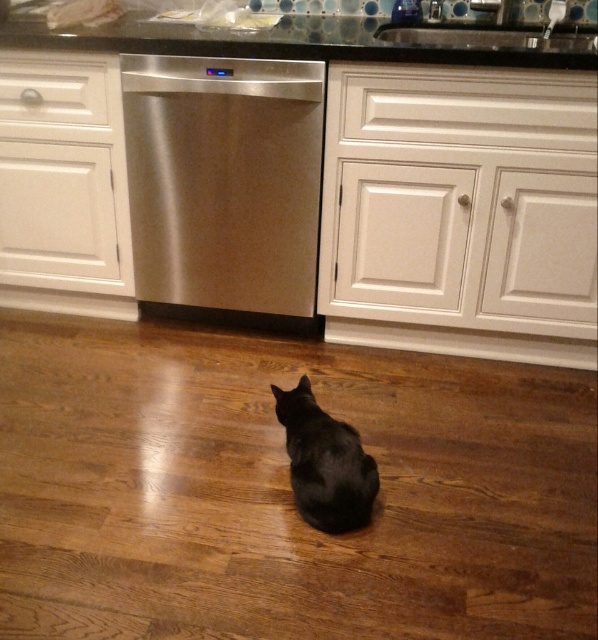
Question: Estimate the real-world distances between objects in this image. Which object is closer to the black fur cat at center?

Choices:
 (A) glassy granite countertop at upper center
 (B) stainless steel dishwasher at center

Answer: (B)

Question: Which object appears closest to the camera in this image?

Choices:
 (A) glassy granite countertop at upper center
 (B) stainless steel dishwasher at center
 (C) black fur cat at center

Answer: (C)

Question: Is the position of stainless steel dishwasher at center less distant than that of black fur cat at center?

Choices:
 (A) no
 (B) yes

Answer: (A)

Question: Is the position of stainless steel dishwasher at center more distant than that of black fur cat at center?

Choices:
 (A) yes
 (B) no

Answer: (A)

Question: Is stainless steel dishwasher at center above glassy granite countertop at upper center?

Choices:
 (A) no
 (B) yes

Answer: (A)

Question: Based on their relative distances, which object is farther from the black fur cat at center?

Choices:
 (A) glassy granite countertop at upper center
 (B) stainless steel dishwasher at center

Answer: (A)